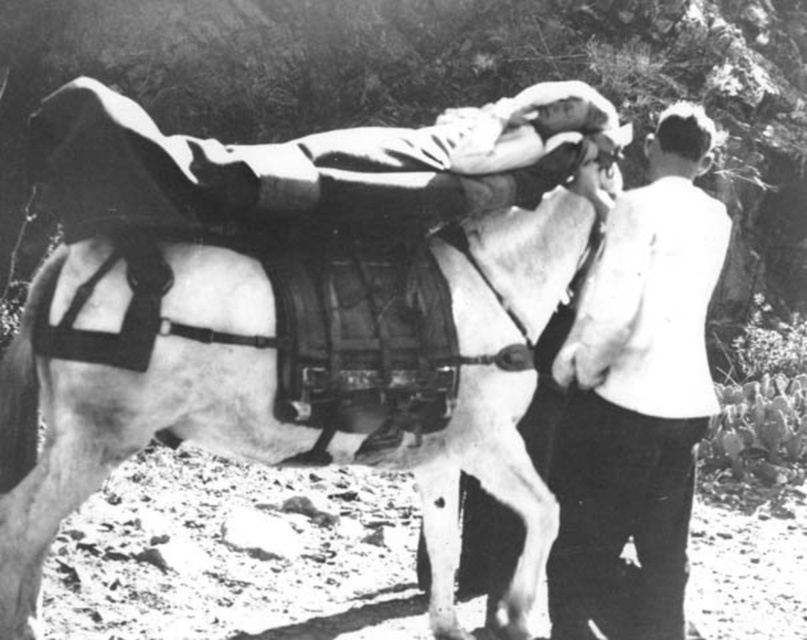
You are a photographer trying to capture a clear photo of the white matte horse at center and the smooth white shirt at right. Since both are white, you need to adjust your camera settings to account for their size difference. Which object should you focus on first to ensure proper exposure?

The white matte horse at center is larger than the smooth white shirt at right, so you should focus on the white matte horse at center first to ensure proper exposure.

You are a photographer in the 1950s trying to capture a photo of the white matte horse at center and the smooth white shirt at right. From which side of the horse should you position yourself to ensure both subjects are fully visible in the frame?

You should position yourself to the right of the white matte horse at center because the smooth white shirt at right is located to the right of the horse, so standing there allows both the horse and the shirt to be in the frame.